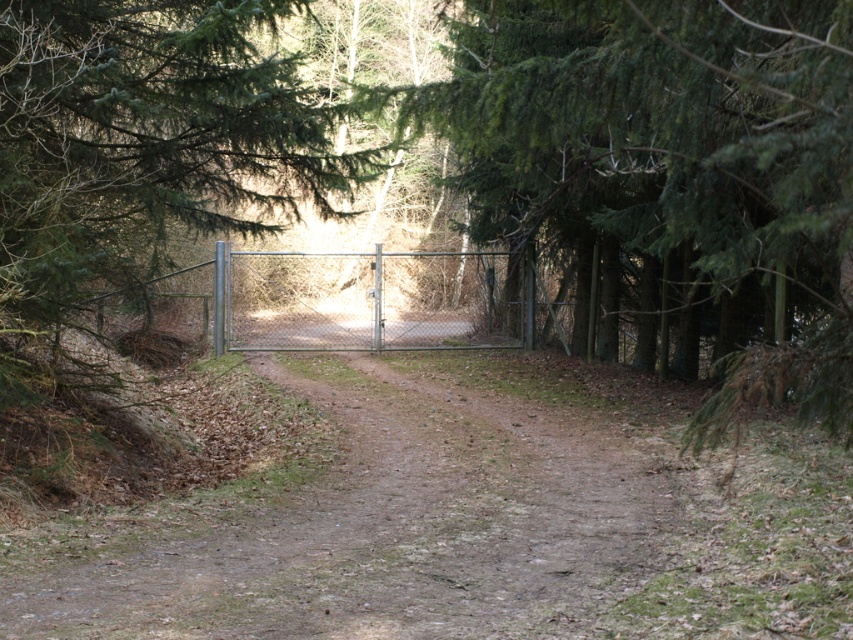
Who is more distant from viewer, (732, 336) or (306, 269)?

Point (306, 269)

What do you see at coordinates (672, 164) in the screenshot? I see `green textured tree at center` at bounding box center [672, 164].

The height and width of the screenshot is (640, 853). What are the coordinates of `green textured tree at center` in the screenshot? It's located at (672, 164).

Which of these two, dirt path at center or metallic chain-link fence at center, stands taller?

dirt path at center

Is point (51, 608) farther from viewer compared to point (299, 257)?

That is False.

Where is `dirt path at center`? This screenshot has height=640, width=853. dirt path at center is located at coordinates pos(386,513).

This screenshot has width=853, height=640. What are the coordinates of `dirt path at center` in the screenshot? It's located at (386, 513).

Which is in front, point (564, 541) or point (788, 32)?

Positioned in front is point (788, 32).

Where is `dirt path at center`? Image resolution: width=853 pixels, height=640 pixels. dirt path at center is located at coordinates (386, 513).